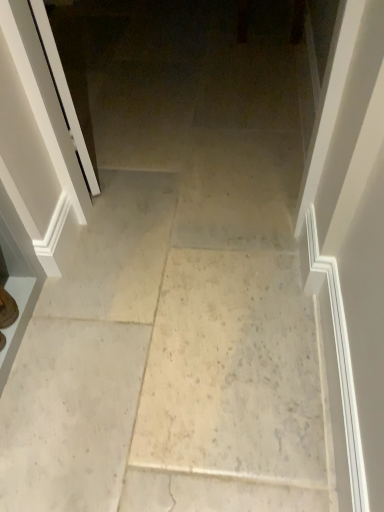
This screenshot has width=384, height=512. Find the location of `unoccupied space behind white glossy screen door at left`. unoccupied space behind white glossy screen door at left is located at coordinates (110, 99).